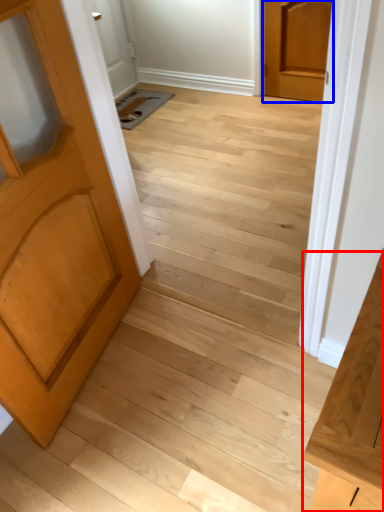
Question: Which point is further to the camera, vanity (highlighted by a red box) or door (highlighted by a blue box)?

Choices:
 (A) vanity
 (B) door

Answer: (B)